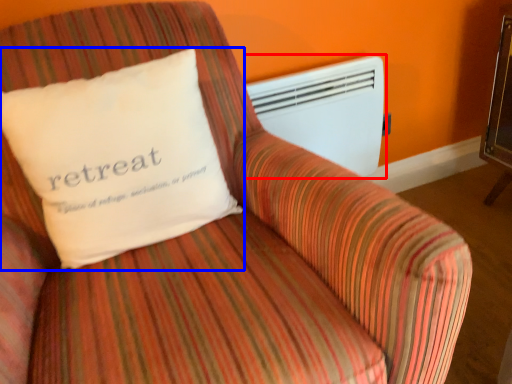
Question: Which object appears closest to the camera in this image, air conditioning (highlighted by a red box) or pillow (highlighted by a blue box)?

Choices:
 (A) air conditioning
 (B) pillow

Answer: (B)